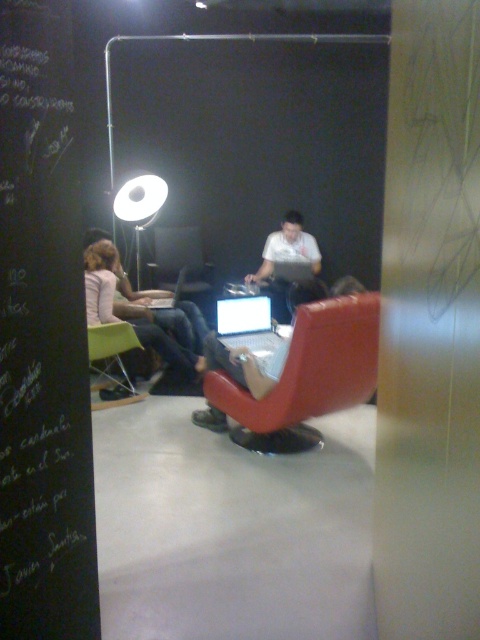
Does green fabric chair at lower left appear on the right side of white glossy floor lamp at upper left?

Correct, you'll find green fabric chair at lower left to the right of white glossy floor lamp at upper left.

What do you see at coordinates (112, 360) in the screenshot? The image size is (480, 640). I see `green fabric chair at lower left` at bounding box center [112, 360].

What do you see at coordinates (112, 360) in the screenshot? The height and width of the screenshot is (640, 480). I see `green fabric chair at lower left` at bounding box center [112, 360].

The height and width of the screenshot is (640, 480). What are the coordinates of `green fabric chair at lower left` in the screenshot? It's located at (112, 360).

Is white matte shirt at center shorter than silver metallic laptop at center?

No, white matte shirt at center is not shorter than silver metallic laptop at center.

Who is lower down, white matte shirt at center or silver metallic laptop at center?

silver metallic laptop at center is lower down.

Describe the element at coordinates (286, 259) in the screenshot. I see `white matte shirt at center` at that location.

Locate an element on the screen. The height and width of the screenshot is (640, 480). white matte shirt at center is located at coordinates (286, 259).

Does black chalkboard at left have a greater height compared to white matte shirt at center?

Yes, black chalkboard at left is taller than white matte shirt at center.

What are the coordinates of `black chalkboard at left` in the screenshot? It's located at (43, 339).

Is point (73, 353) in front of point (272, 250)?

Yes, point (73, 353) is closer to viewer.

Locate an element on the screen. Image resolution: width=480 pixels, height=640 pixels. black chalkboard at left is located at coordinates (43, 339).